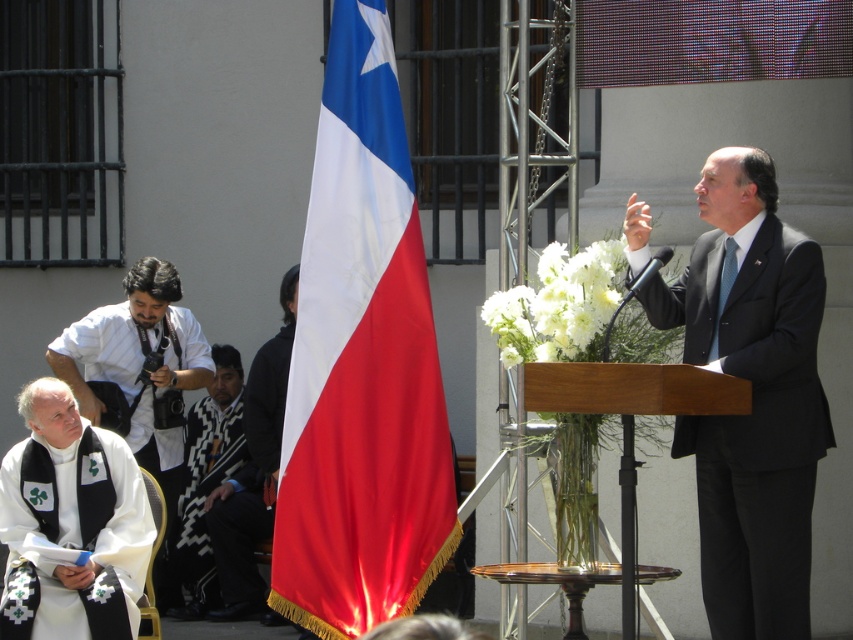
Question: Which object is closer to the camera taking this photo?

Choices:
 (A) white fabric shirt at left
 (B) matte black robe at right
 (C) silky satin flag at center

Answer: (B)

Question: Among these points, which one is nearest to the camera?

Choices:
 (A) (717, 266)
 (B) (192, 413)
 (C) (167, 602)

Answer: (A)

Question: Is silky satin flag at center closer to the viewer compared to black and white zigzag scarf at lower left?

Choices:
 (A) no
 (B) yes

Answer: (B)

Question: Is silky satin flag at center behind matte black robe at right?

Choices:
 (A) no
 (B) yes

Answer: (B)

Question: Is silky satin flag at center to the left of black and white zigzag scarf at lower left from the viewer's perspective?

Choices:
 (A) yes
 (B) no

Answer: (B)

Question: Which of these objects is positioned closest to the black and white zigzag scarf at lower left?

Choices:
 (A) white fabric shirt at left
 (B) black woven robe at lower left
 (C) silky satin flag at center

Answer: (B)